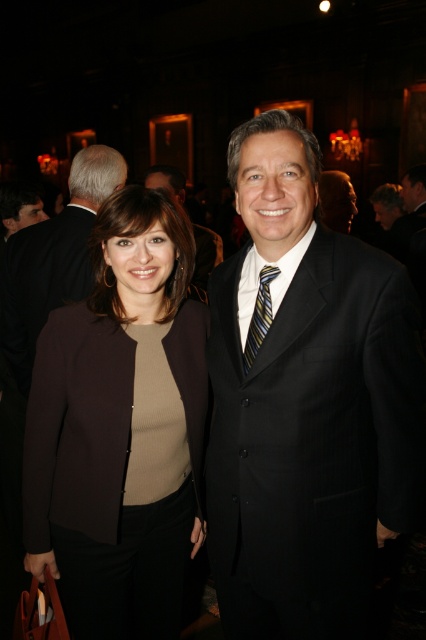
Question: Among these points, which one is nearest to the camera?

Choices:
 (A) (43, 412)
 (B) (268, 573)

Answer: (B)

Question: Which of these objects is positioned farthest from the matte brown blazer at center?

Choices:
 (A) matte black suit at center
 (B) matte black suit at left

Answer: (B)

Question: Considering the relative positions of matte black suit at left and striped silk tie at center in the image provided, where is matte black suit at left located with respect to striped silk tie at center?

Choices:
 (A) below
 (B) above

Answer: (B)

Question: Observing the image, what is the correct spatial positioning of black pinstripe suit at center in reference to matte black suit at center?

Choices:
 (A) right
 (B) left

Answer: (A)

Question: Which point is closer to the camera?

Choices:
 (A) black pinstripe suit at center
 (B) striped silk tie at center
 (C) matte black suit at center

Answer: (A)

Question: Can you confirm if matte black suit at center is thinner than striped silk tie at center?

Choices:
 (A) yes
 (B) no

Answer: (B)